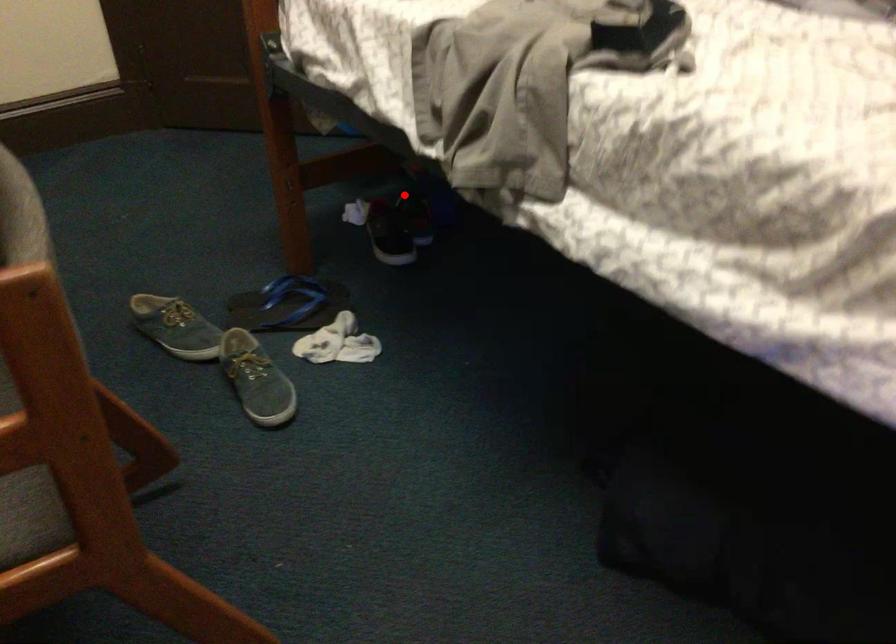
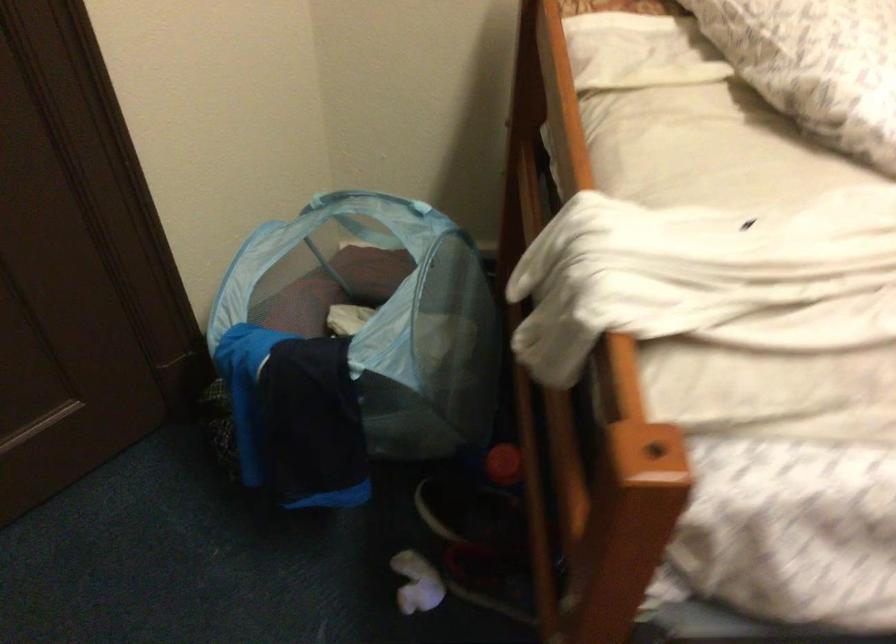
Question: I am providing you with two images of the same scene from different viewpoints. Image1 has a red point marked. In image2, the corresponding 3D location appears at what relative position? Reply with the corresponding letter.

Choices:
 (A) Closer
 (B) Farther

Answer: (A)